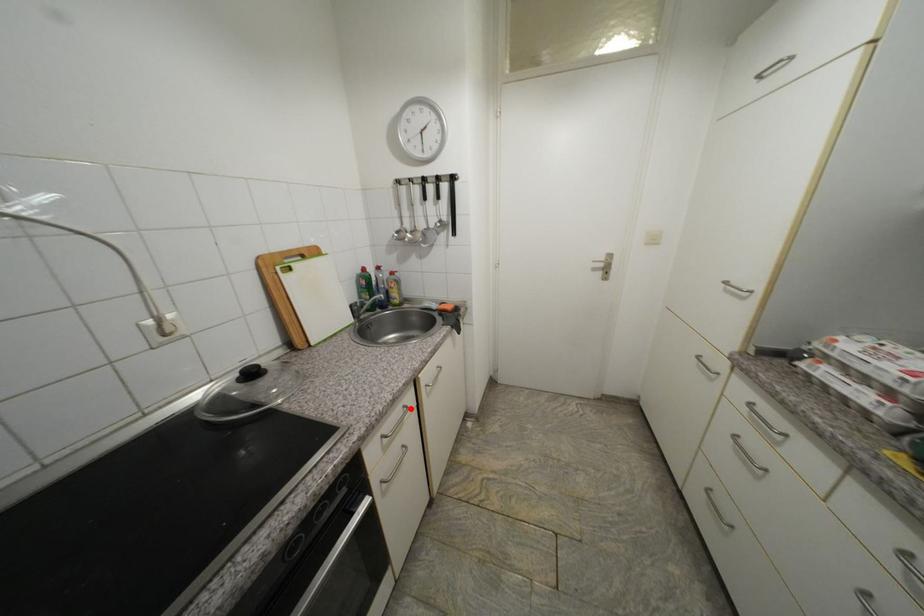
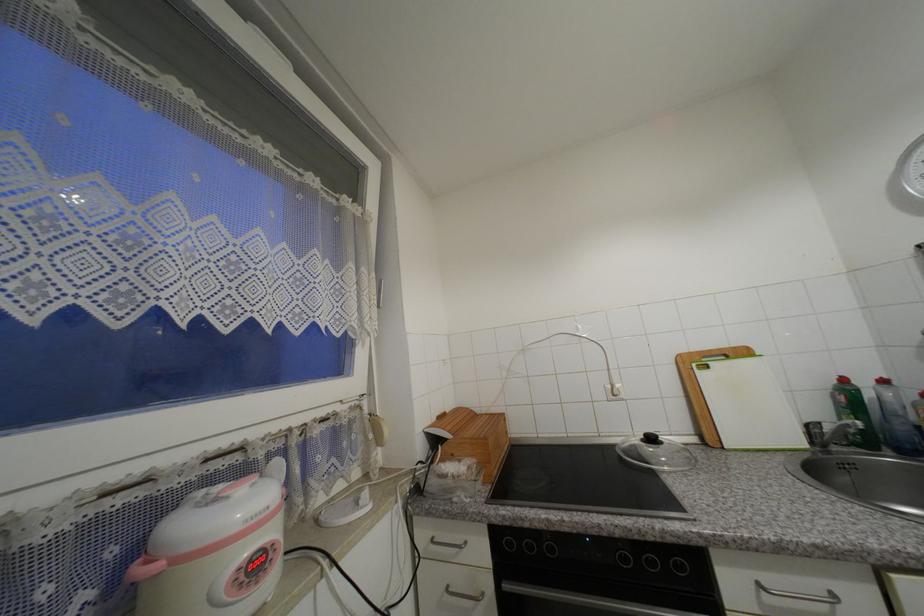
In the second image, find the point that corresponds to the highlighted location in the first image.

(840, 597)